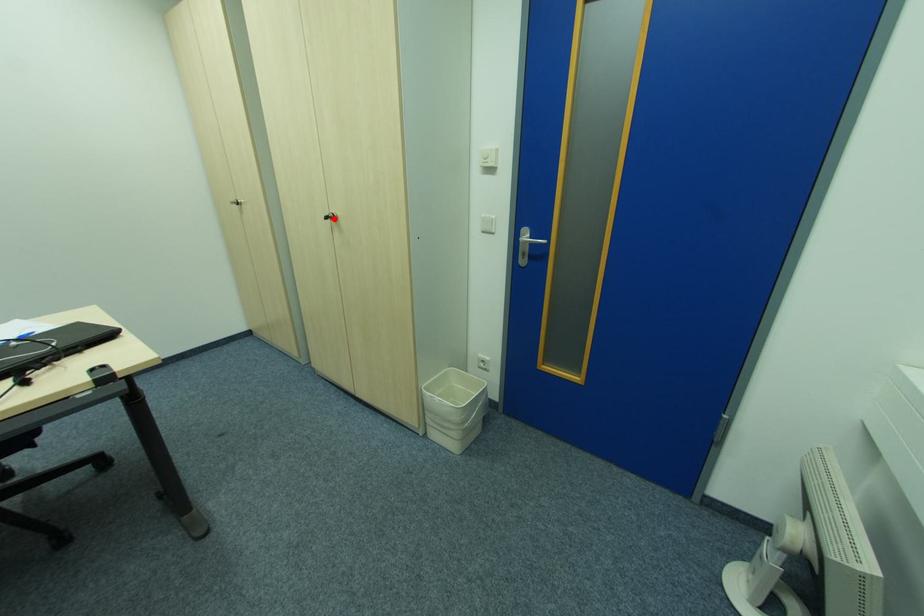
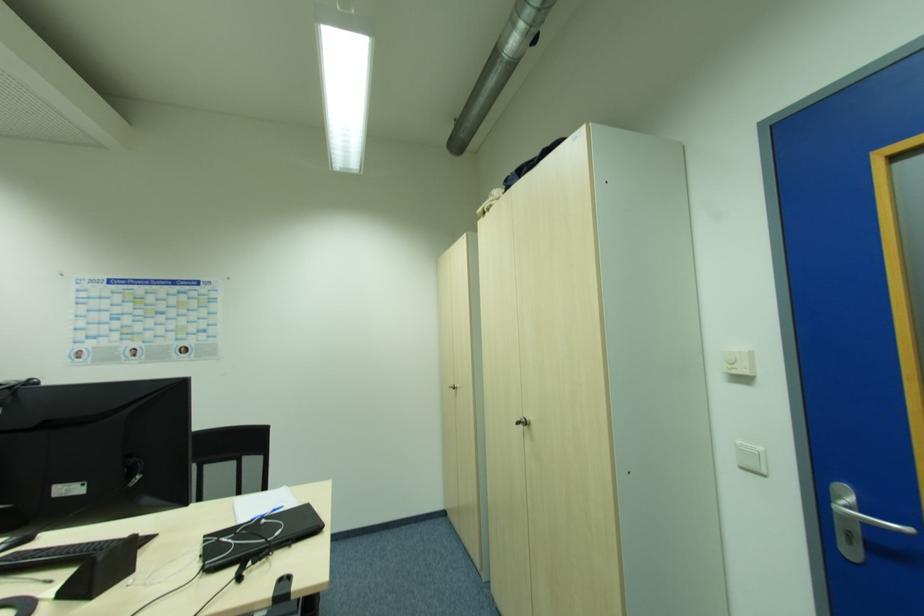
Find the pixel in the second image that matches the highlighted location in the first image.

(526, 424)